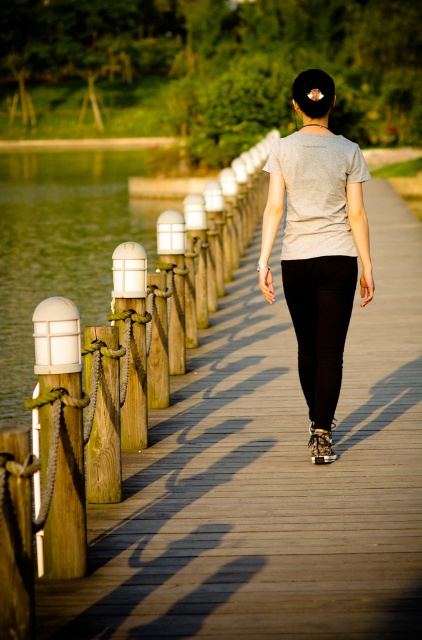
You are standing on the wooden pier and want to walk towards the white painted wood post at left. Which direction should you face to move towards it from the white matte pole at left?

Since the white matte pole at left is to the left of the white painted wood post at left, you should face to the right to move towards the white painted wood post at left from the white matte pole at left.

Based on the photo, you are standing on the wooden pier and see the gray cotton shirt at center and the white painted wood post at left. Which object is higher in position?

The gray cotton shirt at center is above the white painted wood post at left, so the gray cotton shirt at center is higher in position.